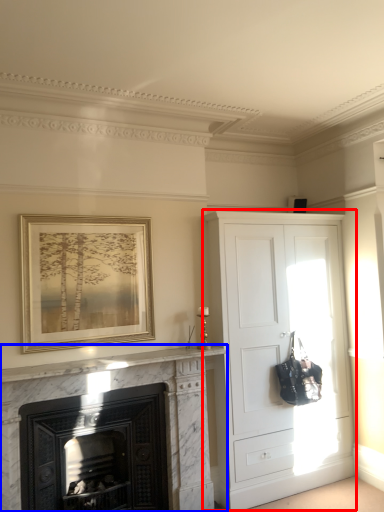
Question: Which point is further to the camera, cupboard (highlighted by a red box) or fireplace (highlighted by a blue box)?

Choices:
 (A) cupboard
 (B) fireplace

Answer: (A)